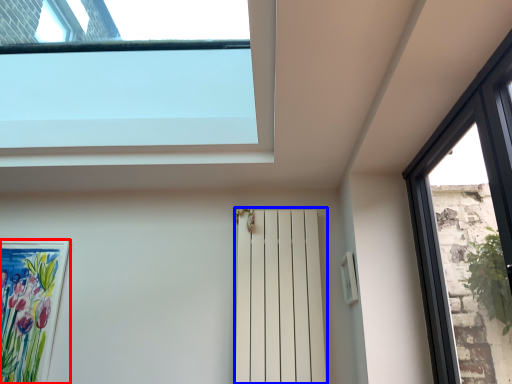
Question: Which object is further to the camera taking this photo, picture frame (highlighted by a red box) or shutter (highlighted by a blue box)?

Choices:
 (A) picture frame
 (B) shutter

Answer: (A)